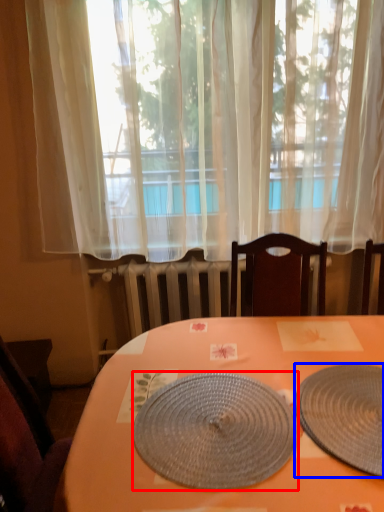
Question: Which object appears farthest to the camera in this image, plate (highlighted by a red box) or plate (highlighted by a blue box)?

Choices:
 (A) plate
 (B) plate

Answer: (A)